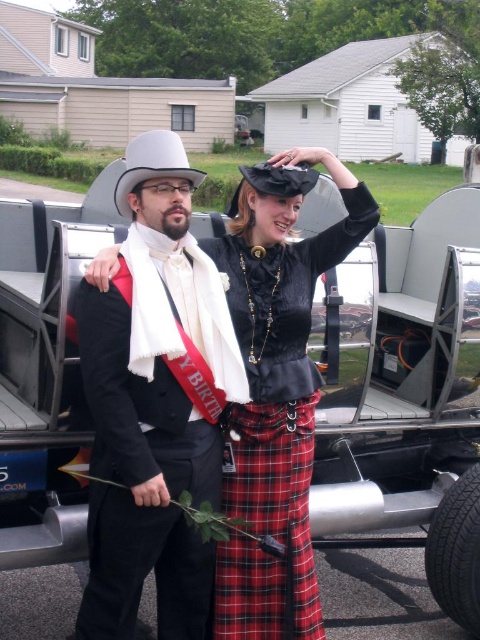
Find the location of a particular element. The height and width of the screenshot is (640, 480). matte black suit at center is located at coordinates (154, 400).

Is point (151, 186) more distant than point (268, 317)?

No, it is in front of (268, 317).

You are a GUI agent. You are given a task and a screenshot of the screen. Output one action in this format:
    pyautogui.click(x=<x>, y=<y>)
    Task: Click on the matte black suit at center
    Image resolution: width=480 pixels, height=640 pixels.
    Given the screenshot: What is the action you would take?
    pyautogui.click(x=154, y=400)